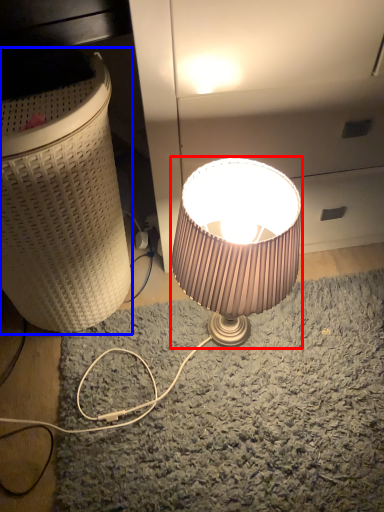
Question: Among these objects, which one is farthest to the camera, lamp (highlighted by a red box) or laundry basket (highlighted by a blue box)?

Choices:
 (A) lamp
 (B) laundry basket

Answer: (A)